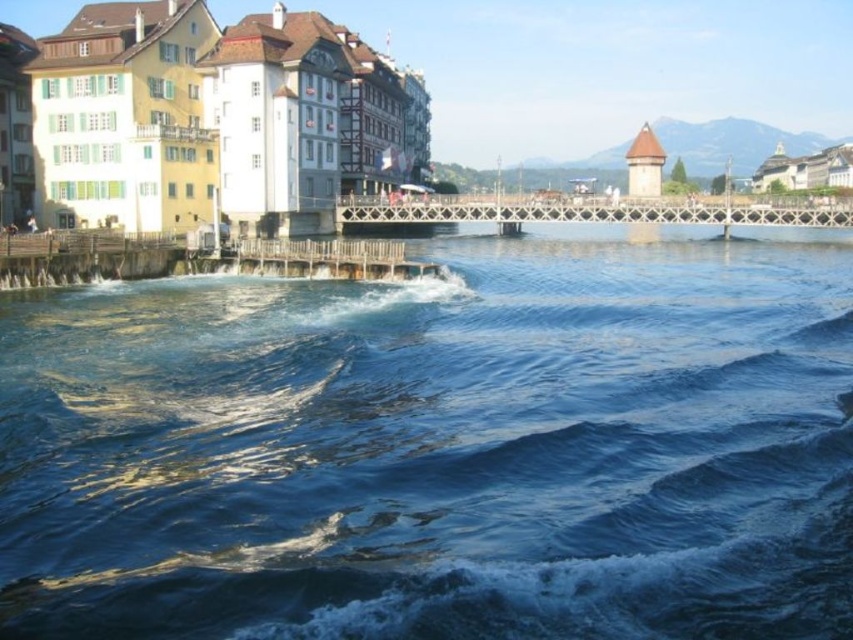
Looking at this image, you are a tourist standing on the wooden bridge and want to take a photo that includes both the blue clear water at center and the white painted wooden buildings at left. Which object should you position closer to the edge of the frame to ensure both fit in the photo?

Since the blue clear water at center is wider than the white painted wooden buildings at left, you should position the white painted wooden buildings at left closer to the edge of the frame to ensure both fit in the photo.

You are standing at the riverside and want to determine which of the two points, point (x=155, y=593) or point (x=305, y=195), is closer to you. Based on the scene, which point is nearer?

Point (x=155, y=593) is closer to the viewer than point (x=305, y=195).

You are a tourist visiting the riverside and want to take a photo that includes both the blue clear water at center and the white painted wooden buildings at left. Which object should you focus on first to ensure both are in the frame?

You should focus on the blue clear water at center first because it is larger in size than the white painted wooden buildings at left, so it will take up more space in the photo and ensure both are included.